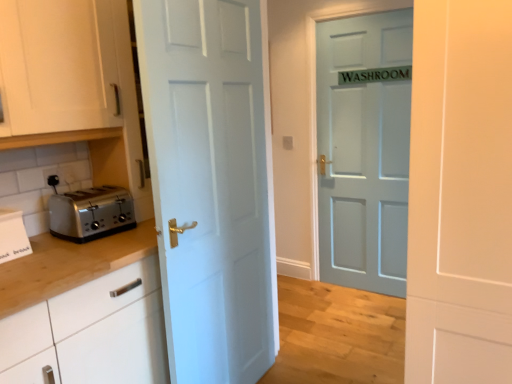
How much space does white glossy door at center, marked as the second door in a back-to-front arrangement, occupy vertically?

1.92 meters.

Based on the photo, measure the distance between white glossy door at center, marked as the second door in a back-to-front arrangement, and camera.

They are 1.43 meters apart.

What is the approximate height of white matte door at center, the first door in the front-to-back sequence?

5.31 feet.

The width and height of the screenshot is (512, 384). I want to click on white cardboard box at left, so click(13, 236).

Choose the correct answer: Is light blue matte door at center, the third door viewed from the front, inside white matte door at center, the 3th door in the back-to-front sequence, or outside it?

light blue matte door at center, the third door viewed from the front, exists outside the volume of white matte door at center, the 3th door in the back-to-front sequence.

Consider the image. Is light blue matte door at center, the 1th door positioned from the back, with white matte door at center, the 3th door in the back-to-front sequence?

No, light blue matte door at center, the 1th door positioned from the back, is not beside white matte door at center, the 3th door in the back-to-front sequence.

From the picture: Is light blue matte door at center, the 1th door positioned from the back, at the right side of white matte door at center, the 3th door in the back-to-front sequence?

Yes.

From the image's perspective, which is below, white matte cabinet at upper left or white glossy door at center, marked as the second door in a back-to-front arrangement?

white glossy door at center, marked as the second door in a back-to-front arrangement, is shown below in the image.

Are white matte cabinet at upper left and white glossy door at center, which is the second door from front to back, beside each other?

No, white matte cabinet at upper left is not next to white glossy door at center, which is the second door from front to back.

Is white glossy door at center, which is the second door from front to back, completely or partially inside white matte cabinet at upper left?

Definitely not — white glossy door at center, which is the second door from front to back, is not inside white matte cabinet at upper left.

Is light blue matte door at center, the 1th door positioned from the back, spatially inside white cardboard box at left, or outside of it?

The correct answer is: outside.

Is light blue matte door at center, the third door viewed from the front, aimed at white cardboard box at left?

Yes, light blue matte door at center, the third door viewed from the front, is oriented towards white cardboard box at left.

Is light blue matte door at center, the 1th door positioned from the back, to the left of white cardboard box at left from the viewer's perspective?

In fact, light blue matte door at center, the 1th door positioned from the back, is to the right of white cardboard box at left.

In terms of size, does light blue matte door at center, the third door viewed from the front, appear bigger or smaller than white cardboard box at left?

In the image, light blue matte door at center, the third door viewed from the front, appears to be larger than white cardboard box at left.

Is white glossy door at center, marked as the second door in a back-to-front arrangement, turned away from white matte cabinet at upper left?

Absolutely, white glossy door at center, marked as the second door in a back-to-front arrangement, is directed away from white matte cabinet at upper left.

Image resolution: width=512 pixels, height=384 pixels. I want to click on the 3rd door positioned below the white matte cabinet at upper left (from a real-world perspective), so click(209, 184).

Which object is closer to the camera taking this photo, white glossy door at center, marked as the second door in a back-to-front arrangement, or white matte cabinet at upper left?

Positioned in front is white matte cabinet at upper left.

From a real-world perspective, is white glossy door at center, which is the second door from front to back, over white matte cabinet at upper left?

No, from a real-world perspective, white glossy door at center, which is the second door from front to back, is not on top of white matte cabinet at upper left.

Locate an element on the screen. The image size is (512, 384). cardboard box on the left of satin silver toaster at left is located at coordinates (13, 236).

Considering the points (57, 224) and (3, 262), which point is in front, point (57, 224) or point (3, 262)?

Point (3, 262)

Is satin silver toaster at left in front of or behind white cardboard box at left in the image?

In the image, satin silver toaster at left appears behind white cardboard box at left.

Considering the sizes of satin silver toaster at left and white cardboard box at left in the image, is satin silver toaster at left wider or thinner than white cardboard box at left?

satin silver toaster at left is wider than white cardboard box at left.

From a real-world perspective, is white matte cabinet at upper left positioned over white matte door at center, the first door in the front-to-back sequence, based on gravity?

Yes, from a real-world perspective, white matte cabinet at upper left is on top of white matte door at center, the first door in the front-to-back sequence.

I want to click on cabinetry on the left of white matte door at center, the first door in the front-to-back sequence, so click(x=57, y=66).

Measure the distance from white matte cabinet at upper left to white matte door at center, the first door in the front-to-back sequence.

white matte cabinet at upper left is 1.35 meters from white matte door at center, the first door in the front-to-back sequence.

Between point (93, 15) and point (421, 150), which one is positioned in front?

The point (421, 150) is more forward.

Could you tell me if white matte door at center, the 3th door in the back-to-front sequence, is facing light blue matte door at center, the third door viewed from the front?

No.

Is white matte door at center, the 3th door in the back-to-front sequence, positioned beyond the bounds of light blue matte door at center, the third door viewed from the front?

Yes, white matte door at center, the 3th door in the back-to-front sequence, is outside of light blue matte door at center, the third door viewed from the front.

Does white matte door at center, the first door in the front-to-back sequence, have a lesser width compared to light blue matte door at center, the third door viewed from the front?

No.

Which point is more forward, (479, 154) or (367, 191)?

The point (479, 154) is more forward.

Locate an element on the screen. This screenshot has width=512, height=384. the 1st door below the light blue matte door at center, the 1th door positioned from the back (from a real-world perspective) is located at coordinates (460, 194).

At what (x,y) coordinates should I click in order to perform the action: click on the 1st door to the right when counting from the white matte cabinet at upper left. Please return your answer as a coordinate pair (x, y). Looking at the image, I should click on (209, 184).

Considering their positions, is white cardboard box at left positioned further to satin silver toaster at left than light blue matte door at center, the third door viewed from the front?

light blue matte door at center, the third door viewed from the front.

From the image, which object appears to be nearer to white matte door at center, the 3th door in the back-to-front sequence, white matte cabinet at upper left or light blue matte door at center, the third door viewed from the front?

white matte cabinet at upper left is positioned closer to the anchor white matte door at center, the 3th door in the back-to-front sequence.

Which object lies further to the anchor point white matte door at center, the first door in the front-to-back sequence, light blue matte door at center, the 1th door positioned from the back, or white cardboard box at left?

light blue matte door at center, the 1th door positioned from the back, lies further to white matte door at center, the first door in the front-to-back sequence, than the other object.

Based on their spatial positions, is white glossy door at center, which is the second door from front to back, or white cardboard box at left closer to satin silver toaster at left?

white cardboard box at left lies closer to satin silver toaster at left than the other object.

Based on their spatial positions, is white matte door at center, the first door in the front-to-back sequence, or white matte cabinet at upper left closer to white glossy door at center, marked as the second door in a back-to-front arrangement?

white matte cabinet at upper left.

Which object lies further to the anchor point white matte cabinet at upper left, light blue matte door at center, the 1th door positioned from the back, or white glossy door at center, which is the second door from front to back?

light blue matte door at center, the 1th door positioned from the back, is further to white matte cabinet at upper left.

Based on their spatial positions, is satin silver toaster at left or white cardboard box at left further from light blue matte door at center, the 1th door positioned from the back?

white cardboard box at left.

Estimate the real-world distances between objects in this image. Which object is closer to white glossy door at center, marked as the second door in a back-to-front arrangement, light blue matte door at center, the 1th door positioned from the back, or white matte door at center, the first door in the front-to-back sequence?

white matte door at center, the first door in the front-to-back sequence, is positioned closer to the anchor white glossy door at center, marked as the second door in a back-to-front arrangement.

Where is `toaster located between white cardboard box at left and light blue matte door at center, the third door viewed from the front, in the left-right direction`? The height and width of the screenshot is (384, 512). toaster located between white cardboard box at left and light blue matte door at center, the third door viewed from the front, in the left-right direction is located at coordinates (91, 213).

Image resolution: width=512 pixels, height=384 pixels. In order to click on toaster that lies between white matte cabinet at upper left and white cardboard box at left from top to bottom in this screenshot , I will do `click(91, 213)`.

Image resolution: width=512 pixels, height=384 pixels. I want to click on door between white matte cabinet at upper left and white matte door at center, the 3th door in the back-to-front sequence, in the horizontal direction, so pos(209,184).

Where is `toaster situated between white matte cabinet at upper left and light blue matte door at center, the 1th door positioned from the back, from left to right`? This screenshot has width=512, height=384. toaster situated between white matte cabinet at upper left and light blue matte door at center, the 1th door positioned from the back, from left to right is located at coordinates (91, 213).